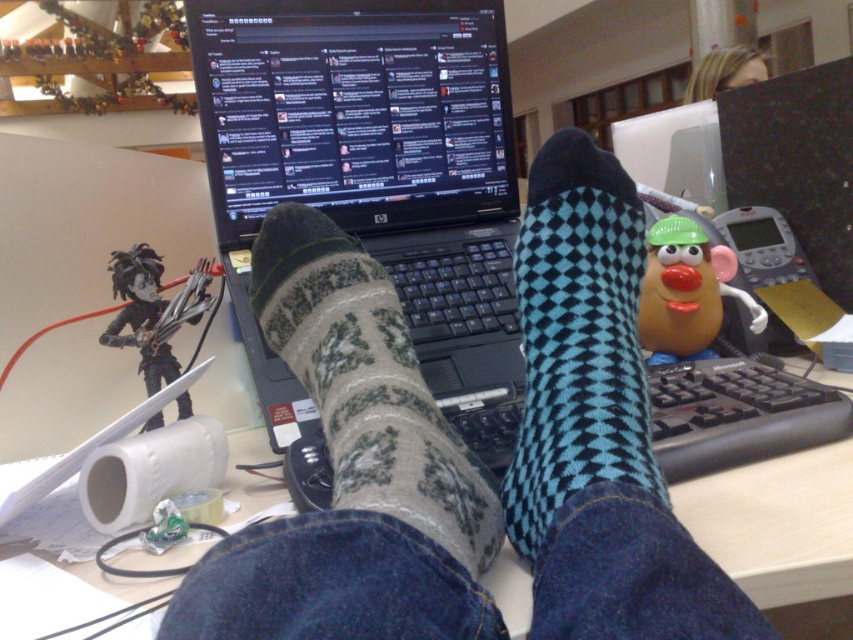
Question: Which point appears farthest from the camera in this image?

Choices:
 (A) (697, 276)
 (B) (727, 88)
 (C) (109, 336)

Answer: (B)

Question: Which object appears farthest from the camera in this image?

Choices:
 (A) black matte figure at center
 (B) black plastic keyboard at center
 (C) green knitted socks at center
 (D) white paper at center

Answer: (A)

Question: Can you confirm if black matte figure at center is thinner than rubber nose at center?

Choices:
 (A) yes
 (B) no

Answer: (B)

Question: Can you confirm if white paper at center is thinner than black plastic keyboard at center?

Choices:
 (A) no
 (B) yes

Answer: (B)

Question: Considering the relative positions of black glossy laptop at center and blonde hair at upper center in the image provided, where is black glossy laptop at center located with respect to blonde hair at upper center?

Choices:
 (A) below
 (B) above

Answer: (A)

Question: Considering the real-world distances, which object is closest to the green knitted socks at center?

Choices:
 (A) black glossy laptop at center
 (B) white paper at center
 (C) teal checkered sock at center
 (D) rubber nose at center

Answer: (C)